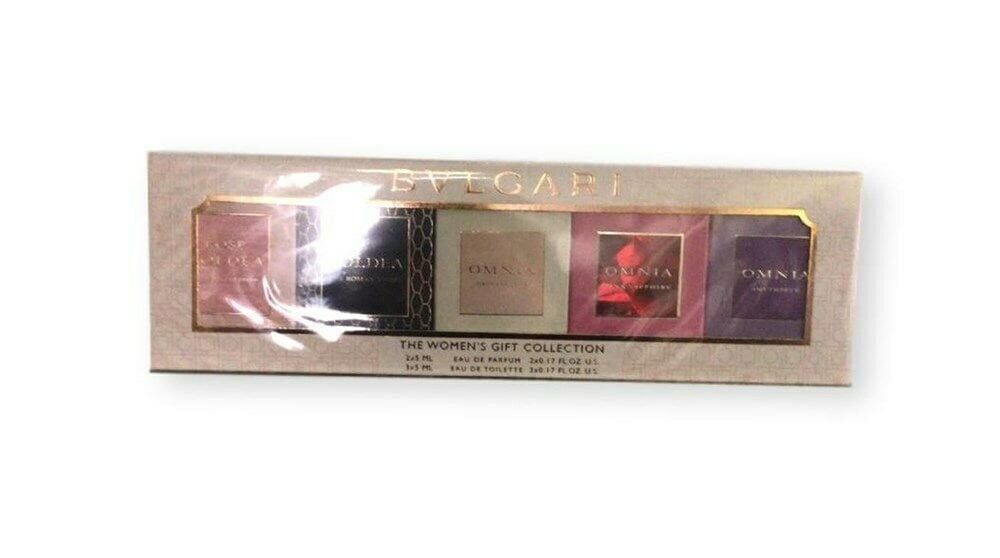
The image size is (1000, 558). I want to click on box, so click(x=543, y=327).